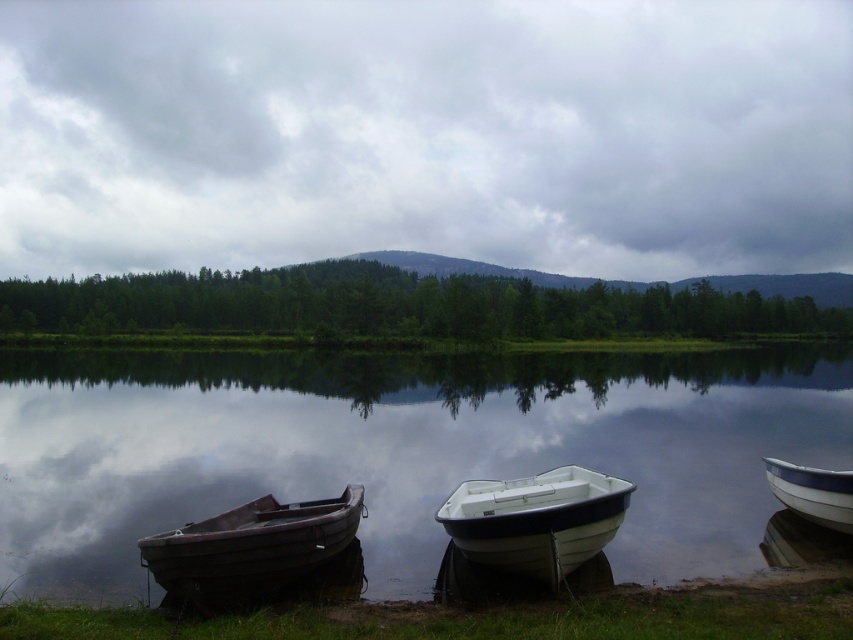
Question: Does glossy reflective water at center have a lesser width compared to green matte trees at center?

Choices:
 (A) yes
 (B) no

Answer: (A)

Question: Does green matte trees at center appear on the right side of dark brown wooden boat at lower left?

Choices:
 (A) yes
 (B) no

Answer: (A)

Question: Which point is farther to the camera?

Choices:
 (A) dark brown wooden boat at lower left
 (B) green matte trees at center
 (C) glossy reflective water at center
 (D) white glossy boat at right

Answer: (B)

Question: Can you confirm if glossy reflective water at center is wider than green matte trees at center?

Choices:
 (A) yes
 (B) no

Answer: (B)

Question: Which point is closer to the camera?

Choices:
 (A) (292, 513)
 (B) (816, 502)
 (C) (469, 490)
 (D) (363, 406)

Answer: (B)

Question: Which point appears closest to the camera in this image?

Choices:
 (A) (350, 518)
 (B) (793, 483)
 (C) (740, 376)
 (D) (229, 289)

Answer: (A)